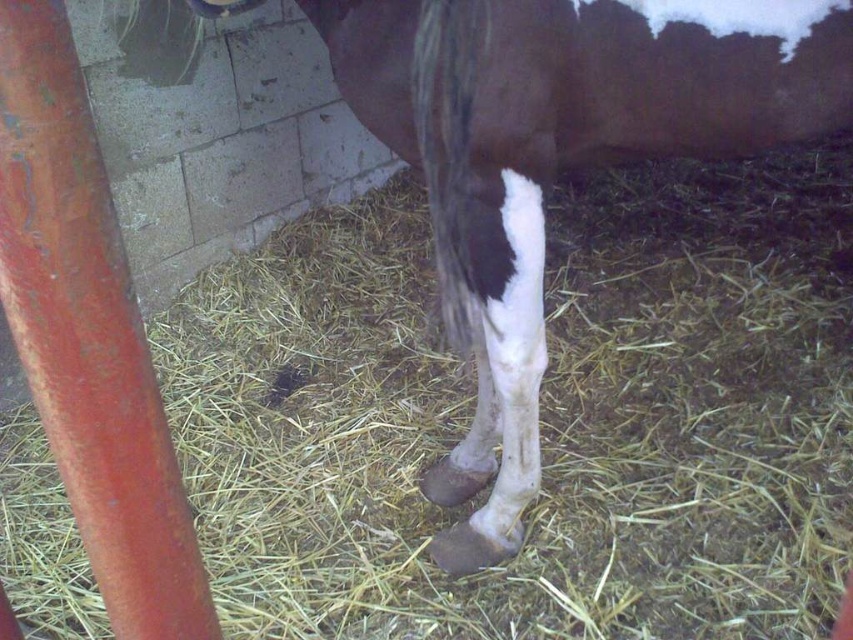
You are standing in the stable and see two points marked in the image. Which point is closer to you, point (488, 154) or point (456, 330)?

Point (488, 154) is in front of point (456, 330), so it is closer to you.